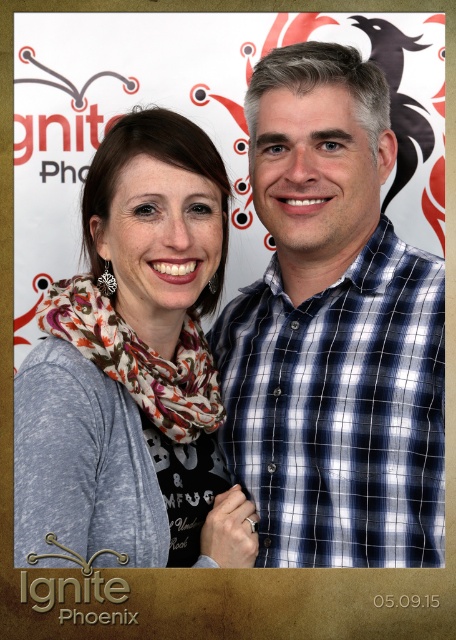
You are a photographer trying to adjust the lighting for a photo shoot. You notice the blue checkered shirt at center and the floral print scarf at upper left. Which object is closer to the camera based on their positions?

The blue checkered shirt at center is in front of the floral print scarf at upper left, meaning it is closer to the camera.

You are taking a photo of two points in the scene. Which point is closer to the camera? The points are labeled as point 1 at coordinates point (x=134, y=326) and point 2 at coordinates point (x=207, y=385). Please answer based on their positions in the image.

Point 1 at coordinates point (x=134, y=326) is closer to the camera than point 2 at coordinates point (x=207, y=385).